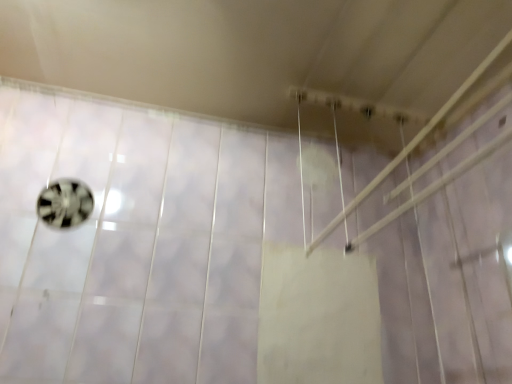
In order to face white plastic shower at upper center, should I rotate leftwards or rightwards?

You should rotate right by 22.464 degrees.

Where is `white plastic shower at upper center`? The width and height of the screenshot is (512, 384). white plastic shower at upper center is located at coordinates (413, 141).

The height and width of the screenshot is (384, 512). What do you see at coordinates (413, 141) in the screenshot? I see `white plastic shower at upper center` at bounding box center [413, 141].

What do you see at coordinates (65, 203) in the screenshot?
I see `metallic silver ball at left` at bounding box center [65, 203].

This screenshot has width=512, height=384. Find the location of `metallic silver ball at left`. metallic silver ball at left is located at coordinates (65, 203).

Find the location of a particular element. white plastic shower at upper center is located at coordinates (413, 141).

In the scene shown: Between metallic silver ball at left and white plastic shower at upper center, which one appears on the right side from the viewer's perspective?

white plastic shower at upper center is more to the right.

Considering the relative positions of metallic silver ball at left and white plastic shower at upper center in the image provided, is metallic silver ball at left behind white plastic shower at upper center?

Yes.

Considering the positions of points (87, 192) and (355, 204), is point (87, 192) closer to camera compared to point (355, 204)?

That is False.

From the image's perspective, which object appears higher, metallic silver ball at left or white plastic shower at upper center?

white plastic shower at upper center.

From a real-world perspective, is metallic silver ball at left above or below white plastic shower at upper center?

metallic silver ball at left is below white plastic shower at upper center.

Considering the relative sizes of metallic silver ball at left and white plastic shower at upper center in the image provided, is metallic silver ball at left thinner than white plastic shower at upper center?

Indeed, metallic silver ball at left has a lesser width compared to white plastic shower at upper center.

Can you confirm if metallic silver ball at left is shorter than white plastic shower at upper center?

Indeed, metallic silver ball at left has a lesser height compared to white plastic shower at upper center.

Considering the sizes of objects metallic silver ball at left and white plastic shower at upper center in the image provided, who is smaller, metallic silver ball at left or white plastic shower at upper center?

metallic silver ball at left is smaller.

Is metallic silver ball at left outside of white plastic shower at upper center?

Yes, metallic silver ball at left is located beyond the bounds of white plastic shower at upper center.

Would you say metallic silver ball at left is a long distance from white plastic shower at upper center?

No, there isn't a large distance between metallic silver ball at left and white plastic shower at upper center.

Does metallic silver ball at left turn towards white plastic shower at upper center?

No, metallic silver ball at left is not aimed at white plastic shower at upper center.

What's the angular difference between metallic silver ball at left and white plastic shower at upper center's facing directions?

There is a 5.36-degree angle between the facing directions of metallic silver ball at left and white plastic shower at upper center.

What are the coordinates of `shower in front of the metallic silver ball at left` in the screenshot? It's located at (413, 141).

In the image, is white plastic shower at upper center on the left side or the right side of metallic silver ball at left?

white plastic shower at upper center is positioned on metallic silver ball at left's right side.

Looking at this image, is white plastic shower at upper center in front of or behind metallic silver ball at left in the image?

In the image, white plastic shower at upper center appears in front of metallic silver ball at left.

Is point (488, 65) in front of point (56, 195)?

Yes, it is.

From the image's perspective, who appears lower, white plastic shower at upper center or metallic silver ball at left?

metallic silver ball at left, from the image's perspective.

From a real-world perspective, which is physically above, white plastic shower at upper center or metallic silver ball at left?

In real-world perspective, white plastic shower at upper center is above.

Considering the sizes of objects white plastic shower at upper center and metallic silver ball at left in the image provided, who is thinner, white plastic shower at upper center or metallic silver ball at left?

metallic silver ball at left is thinner.

Who is taller, white plastic shower at upper center or metallic silver ball at left?

white plastic shower at upper center.

Considering the sizes of objects white plastic shower at upper center and metallic silver ball at left in the image provided, who is bigger, white plastic shower at upper center or metallic silver ball at left?

white plastic shower at upper center.

Would you say white plastic shower at upper center is inside or outside metallic silver ball at left?

white plastic shower at upper center is located beyond the bounds of metallic silver ball at left.

Is white plastic shower at upper center beside metallic silver ball at left?

white plastic shower at upper center is not next to metallic silver ball at left, and they're not touching.

Is white plastic shower at upper center oriented away from metallic silver ball at left?

white plastic shower at upper center is not turned away from metallic silver ball at left.

Can you tell me how much white plastic shower at upper center and metallic silver ball at left differ in facing direction?

white plastic shower at upper center and metallic silver ball at left are facing 5.36 degrees away from each other.

Locate an element on the screen. This screenshot has width=512, height=384. shower in front of the metallic silver ball at left is located at coordinates (413, 141).

This screenshot has width=512, height=384. What are the coordinates of `ball on the left of white plastic shower at upper center` in the screenshot? It's located at (65, 203).

The image size is (512, 384). I want to click on shower on the right of the metallic silver ball at left, so click(x=413, y=141).